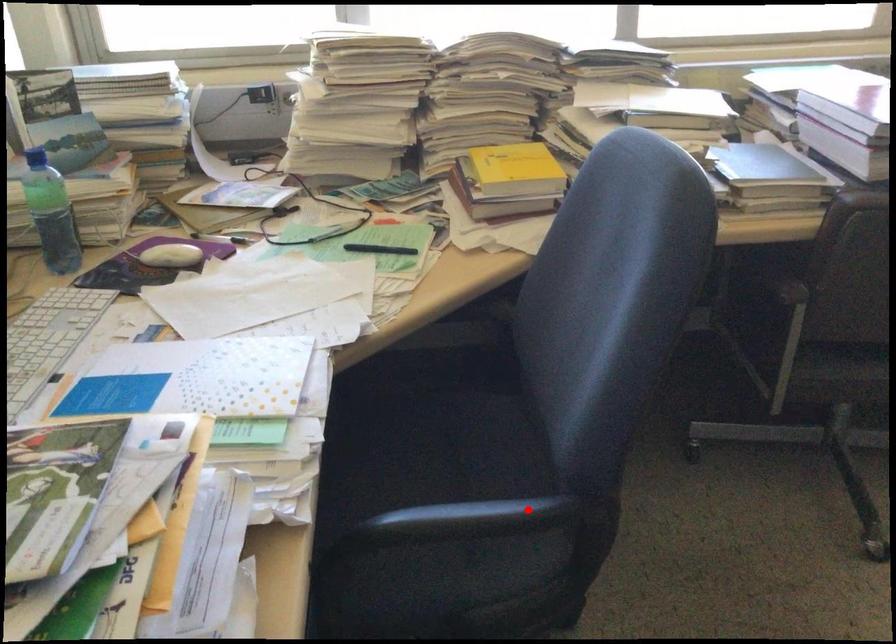
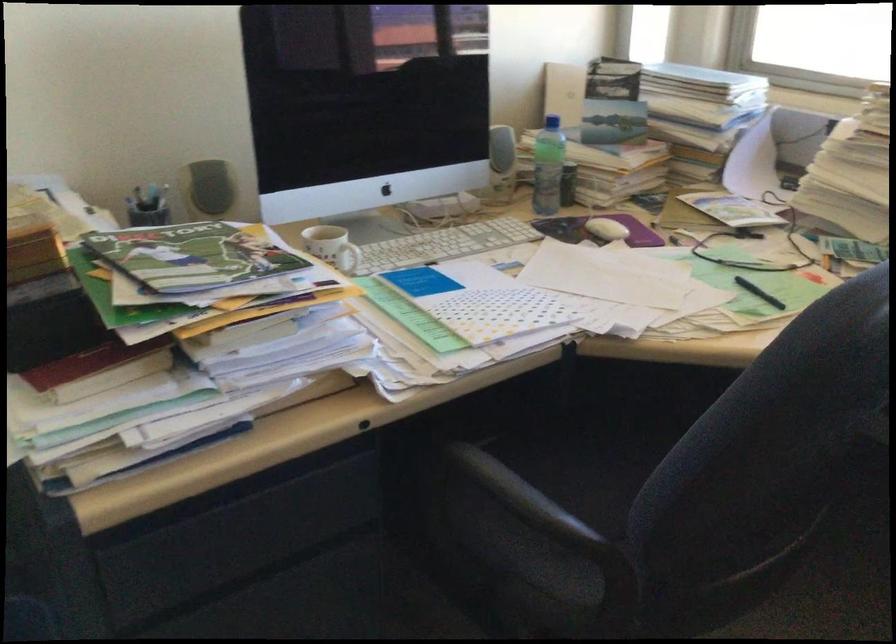
Find the pixel in the second image that matches the highlighted location in the first image.

(532, 506)